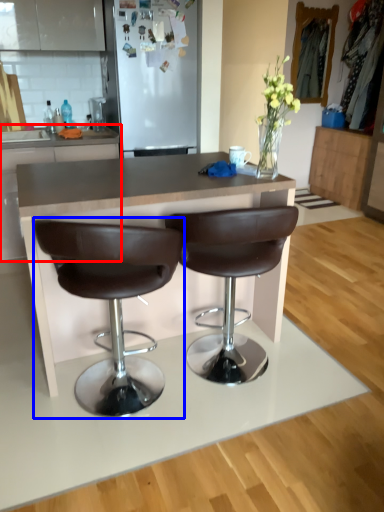
Question: Which object is closer to the camera taking this photo, cabinetry (highlighted by a red box) or chair (highlighted by a blue box)?

Choices:
 (A) cabinetry
 (B) chair

Answer: (B)